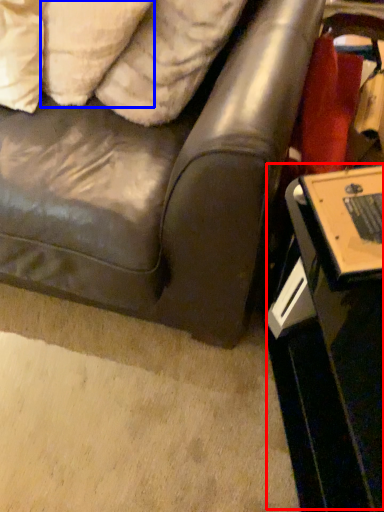
Question: Among these objects, which one is farthest to the camera, table (highlighted by a red box) or pillow (highlighted by a blue box)?

Choices:
 (A) table
 (B) pillow

Answer: (B)